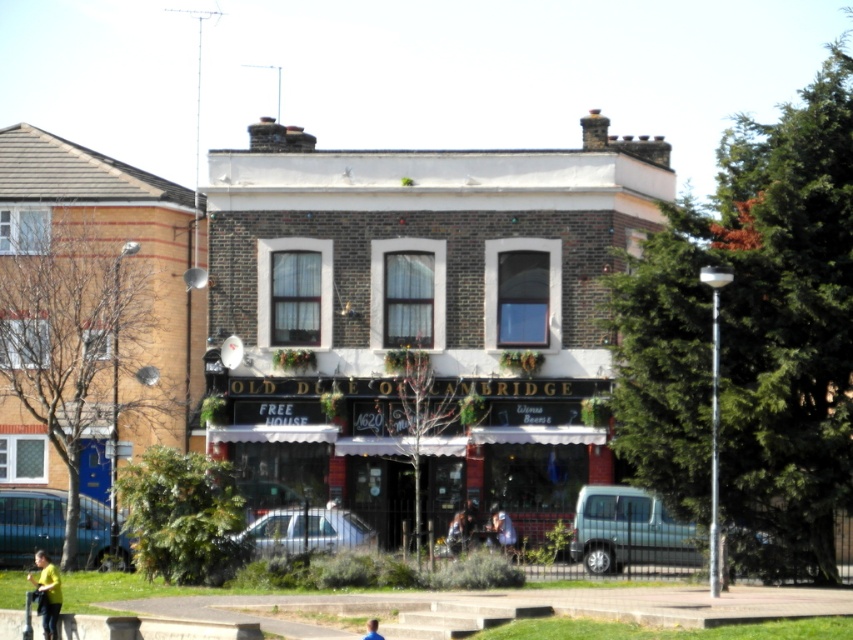
Which of these two, brown brick building at center or black matte signboard at center, stands taller?

brown brick building at center is taller.

Between point (296, 292) and point (503, 500), which one is positioned behind?

The point (296, 292) is more distant.

Identify the location of brown brick building at center. (422, 316).

Measure the distance between light blue shirt at center and camera.

The distance of light blue shirt at center from camera is 42.60 meters.

In the scene shown: Does light blue shirt at center appear under blue fabric at lower center?

Correct, light blue shirt at center is located below blue fabric at lower center.

Which is in front, point (505, 518) or point (374, 625)?

Positioned in front is point (374, 625).

Where is `light blue shirt at center`? light blue shirt at center is located at coordinates coord(502,531).

Is point (91, 566) closer to camera compared to point (335, 534)?

No.

The image size is (853, 640). What do you see at coordinates (30, 524) in the screenshot?
I see `metallic blue van at lower left` at bounding box center [30, 524].

You are a GUI agent. You are given a task and a screenshot of the screen. Output one action in this format:
    pyautogui.click(x=<x>, y=<y>)
    Task: Click on the metallic blue van at lower left
    
    Given the screenshot: What is the action you would take?
    pyautogui.click(x=30, y=524)